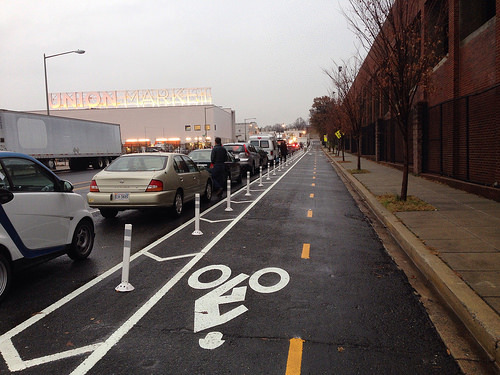
Image resolution: width=500 pixels, height=375 pixels. In order to click on window in this screenshot , I will do `click(196, 126)`.